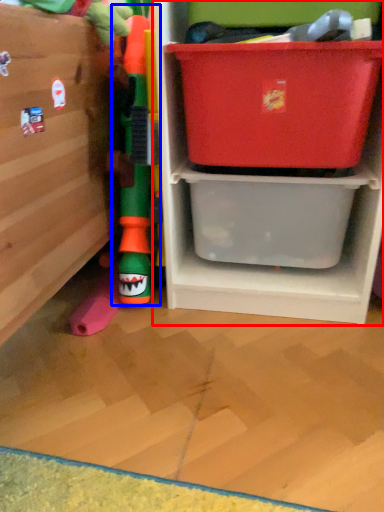
Question: Which object is further to the camera taking this photo, shelf (highlighted by a red box) or toy (highlighted by a blue box)?

Choices:
 (A) shelf
 (B) toy

Answer: (B)